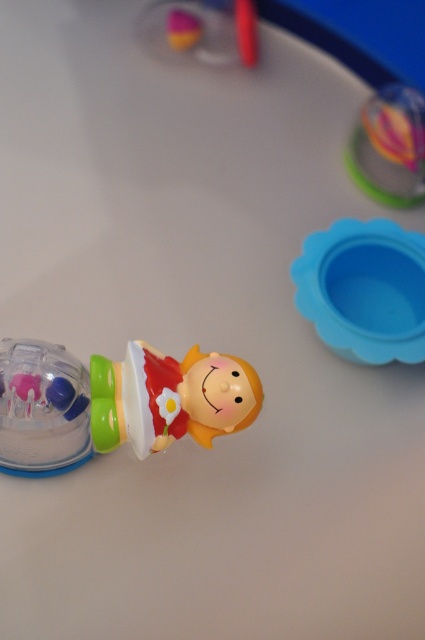
You are looking at the scene from above. There are two points marked in the image. The first point is at coordinates point (316, 262) and the second point is at point (413, 180). Which point is closer to you?

Point (316, 262) is in front of point (413, 180), so it is closer to you.

You are looking at the image of a toy figurine and a plastic bead object. There are two points marked in the image. Which point, point (186,378) or point (360,138), is closer to you?

Point (186,378) is closer to the viewer than point (360,138).

You are organizing a child toy set. You have a blue rubber bowl at center right and a translucent plastic doll at center. Which object has a smaller width?

The blue rubber bowl at center right has a smaller width than the translucent plastic doll at center.